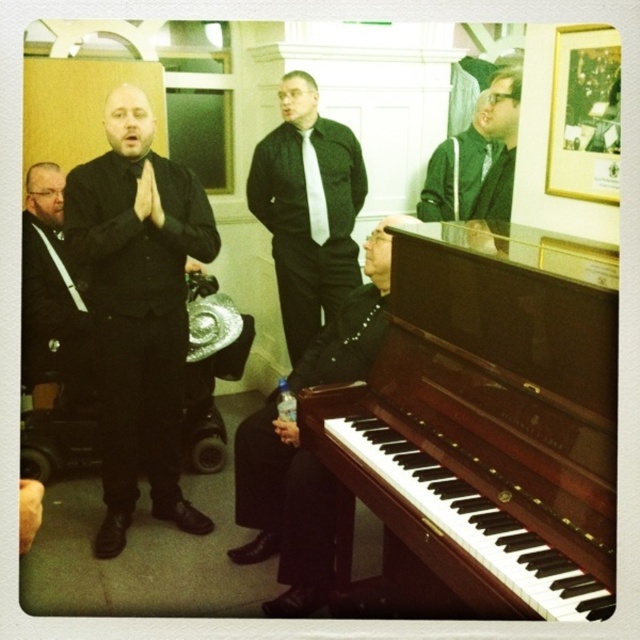
Does matte black suit at center have a greater height compared to green matte jacket at upper center?

Correct, matte black suit at center is much taller as green matte jacket at upper center.

Between matte black suit at center and green matte jacket at upper center, which one has more height?

matte black suit at center is taller.

Who is more forward, [360,275] or [506,100]?

Point [506,100] is more forward.

Find the location of a particular element. The height and width of the screenshot is (640, 640). matte black suit at center is located at coordinates (308, 209).

Does matte black suit at center have a larger size compared to matte black suit at left?

Correct, matte black suit at center is larger in size than matte black suit at left.

Can you confirm if matte black suit at center is thinner than matte black suit at left?

No, matte black suit at center is not thinner than matte black suit at left.

Between point (301, 234) and point (54, 288), which one is positioned behind?

Point (301, 234)

I want to click on matte black suit at center, so click(x=308, y=209).

Who is more distant from viewer, (252, 464) or (490, 138)?

Point (490, 138)

Can you confirm if black leather suit at center is taller than green matte jacket at upper right?

Yes.

This screenshot has width=640, height=640. Find the location of `black leather suit at center`. black leather suit at center is located at coordinates (284, 509).